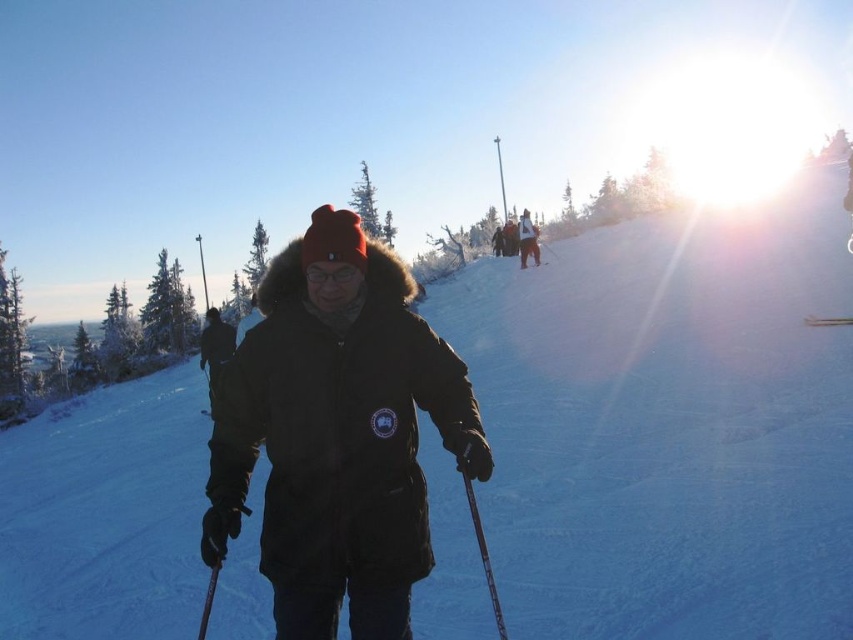
You are a photographer trying to capture a photo of the black matte jacket at center and the matte black ski at upper center. Since both are black, you want to ensure they are distinguishable in the photo. Which object should you focus on to ensure it appears larger in the photo?

The black matte jacket at center is much taller than the matte black ski at upper center, so focusing on the black matte jacket at center will make it appear larger in the photo.

Based on the photo, you are a photographer trying to capture the metallic silver ski at center and the matte black ski at upper center in a single shot. Based on their positions, which ski should you focus on first to ensure both are in frame?

The metallic silver ski at center is located below the matte black ski at upper center, so you should focus on the matte black ski at upper center first to ensure both are in frame.